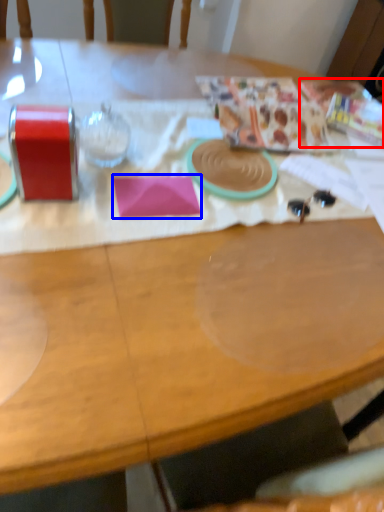
Question: Which object appears closest to the camera in this image, wrapping paper (highlighted by a red box) or notepad (highlighted by a blue box)?

Choices:
 (A) wrapping paper
 (B) notepad

Answer: (B)